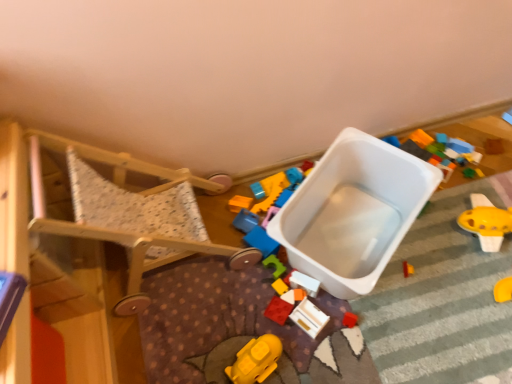
Locate an element on the screen. The image size is (512, 384). vacant space to the right of white plastic toy at center, the 3th toy positioned from the right is located at coordinates (371, 289).